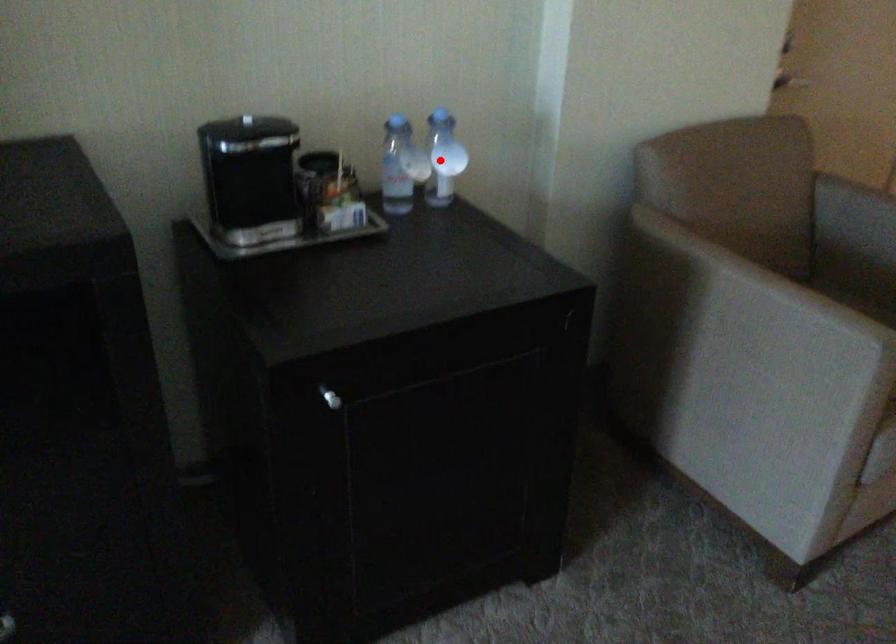
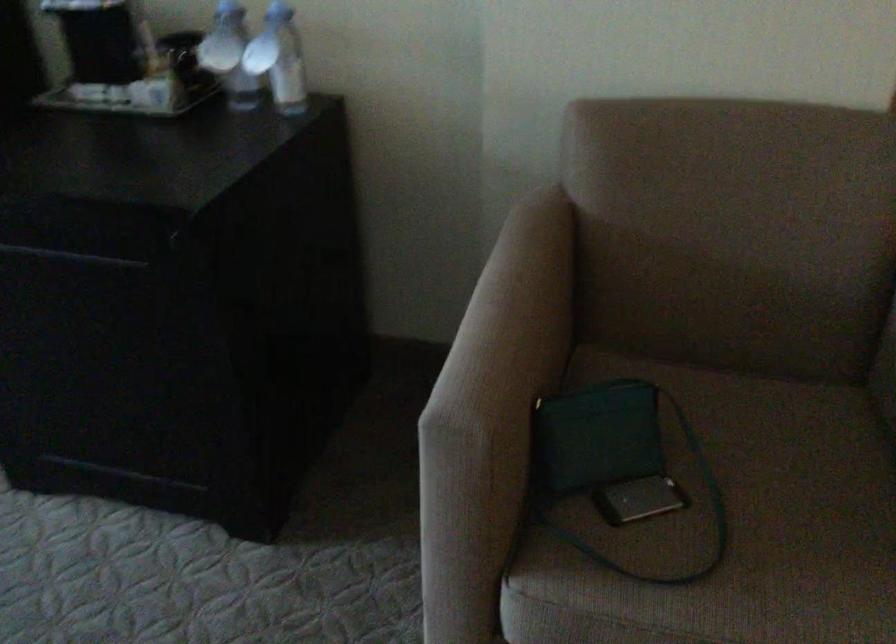
The point at the highlighted location is marked in the first image. Where is the corresponding point in the second image?

(279, 59)